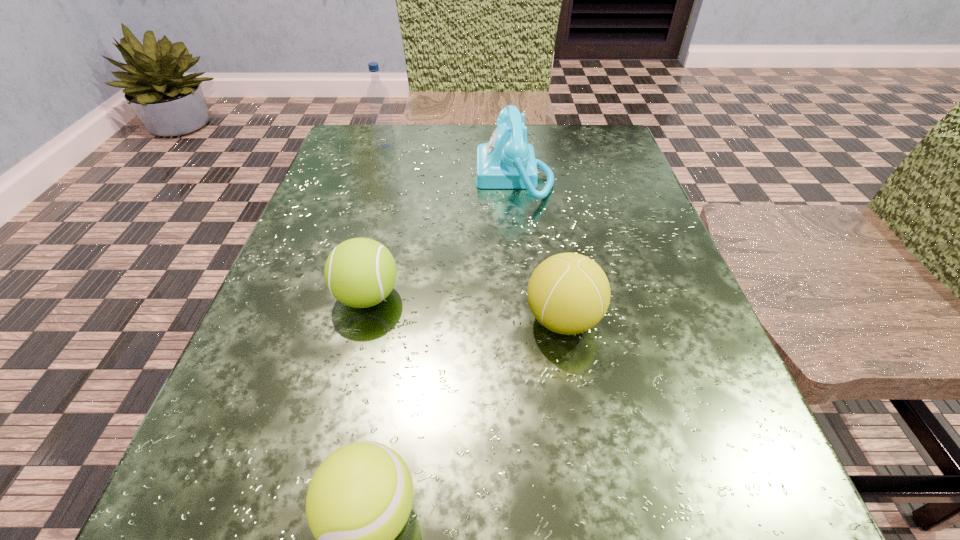
Locate an element on the screen. The image size is (960, 540). water bottle present at the left edge is located at coordinates (377, 94).

Find the location of a particular element. This screenshot has height=540, width=960. tennis ball at the left edge is located at coordinates (360, 272).

Identify the location of object that is at the right edge. (568, 293).

Where is `object that is at the far left corner`? Image resolution: width=960 pixels, height=540 pixels. object that is at the far left corner is located at coordinates (377, 94).

Where is `blank area at the far edge`? The width and height of the screenshot is (960, 540). blank area at the far edge is located at coordinates (442, 156).

Where is `vacant area at the left edge`? This screenshot has width=960, height=540. vacant area at the left edge is located at coordinates (367, 215).

At what (x,y) coordinates should I click in order to perform the action: click on vacant space at the right edge. Please return your answer as a coordinate pair (x, y). This screenshot has width=960, height=540. Looking at the image, I should click on (656, 242).

In order to click on vacant space at the near left corner of the desktop in this screenshot , I will do `click(260, 524)`.

The width and height of the screenshot is (960, 540). Identify the location of free space at the far right corner of the desktop. click(x=580, y=132).

I want to click on free area in between the telephone and the rightmost tennis ball, so click(x=539, y=248).